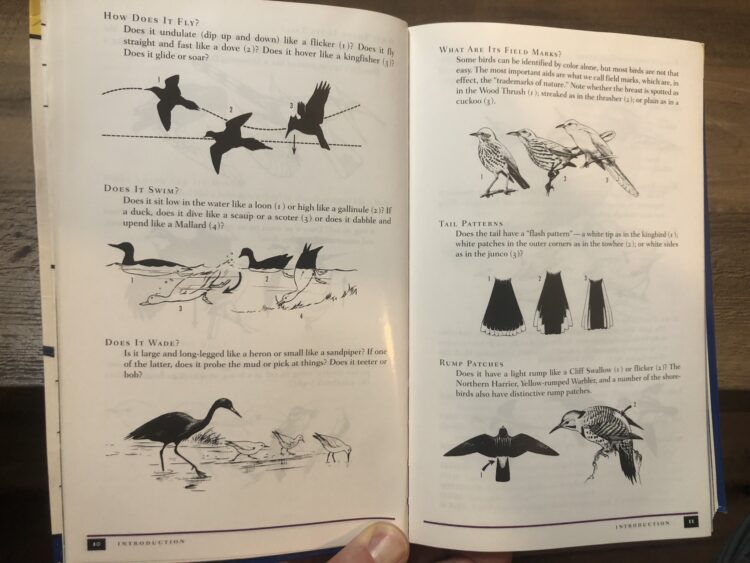
At what (x,y) coordinates should I click in order to perform the action: click on book. Please return your answer as a coordinate pair (x, y). This screenshot has width=750, height=563. Looking at the image, I should click on (410, 214).